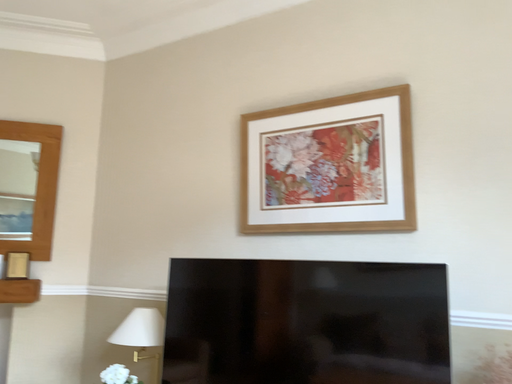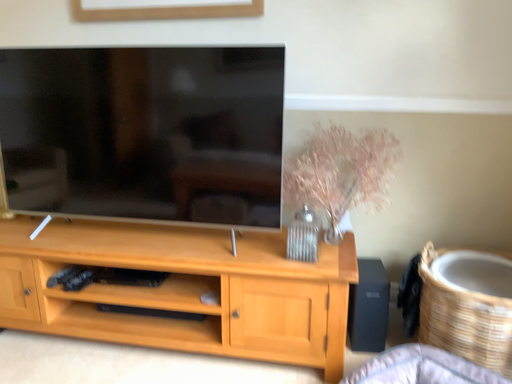
Question: How did the camera likely rotate when shooting the video?

Choices:
 (A) rotated left
 (B) rotated right

Answer: (B)